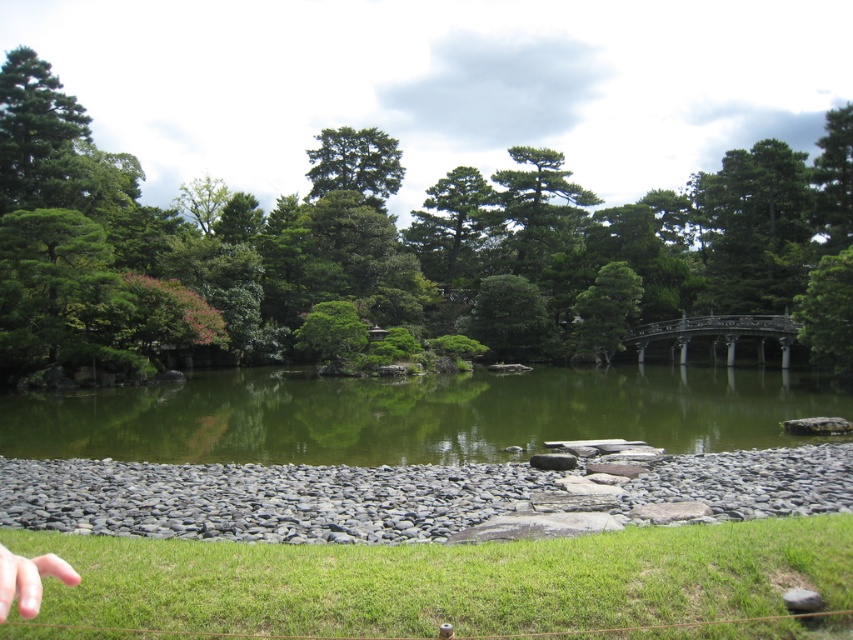
You are a visitor in the Japanese garden and want to take a photo of the green leafy tree at center and the green smooth water at center. Which object should you focus on first if you want to capture both in your shot?

The green leafy tree at center is located above the green smooth water at center, so you should focus on the green leafy tree at center first to ensure both are in frame.

You are a landscape architect designing a walking path in this Japanese garden. The path needs to pass between the green leafy tree at center and the green matte tree at upper center. What is the minimum width required for the path to ensure visitors can walk comfortably between them?

The distance between the green leafy tree at center and the green matte tree at upper center is 21.34 meters. Therefore, the minimum width required for the path should be at least 21.34 meters to allow visitors to walk comfortably between them.

You are a visitor in the Japanese garden and want to take a photo of both the green leafy tree at center and the green smooth water at center. Based on their positions, which object should you adjust your camera angle to capture first if you want to include both in your shot?

The green leafy tree at center is to the right of the green smooth water at center, so you should adjust your camera angle to include the green leafy tree at center first by panning slightly to the right to ensure both objects are in frame.